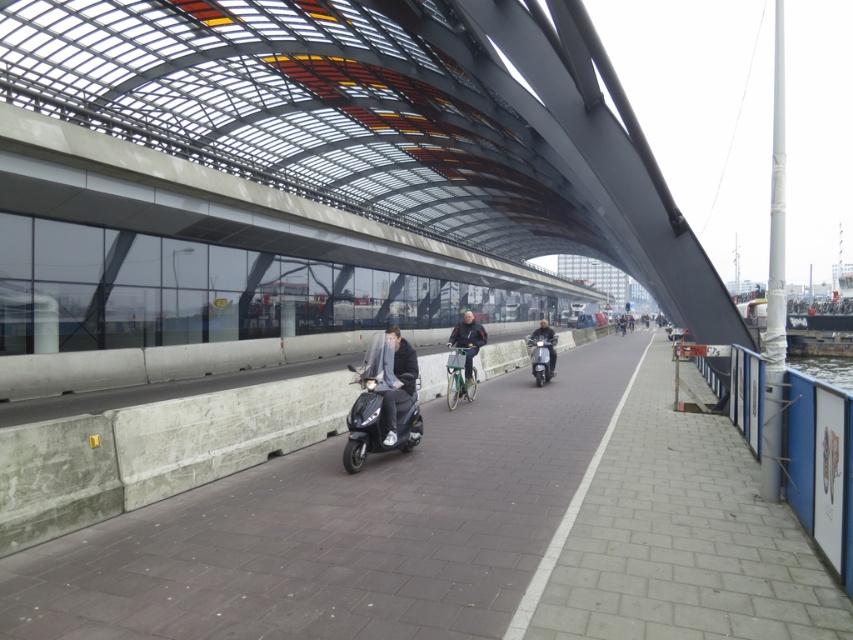
Looking at this image, measure the distance between point (363, 433) and camera.

They are 6.58 meters apart.

Based on the photo, between black matte scooter at center and shiny black scooter at center, which one is positioned lower?

black matte scooter at center

Is point (419, 435) behind point (543, 328)?

No, it is not.

Locate an element on the screen. This screenshot has width=853, height=640. black matte scooter at center is located at coordinates (376, 422).

Is metallic silver bicycle at center behind shiny black scooter at center?

No, metallic silver bicycle at center is closer to the viewer.

Between metallic silver bicycle at center and shiny black scooter at center, which one is positioned higher?

metallic silver bicycle at center is higher up.

The image size is (853, 640). What do you see at coordinates (467, 340) in the screenshot?
I see `metallic silver bicycle at center` at bounding box center [467, 340].

Where is `metallic silver bicycle at center`? The width and height of the screenshot is (853, 640). metallic silver bicycle at center is located at coordinates (467, 340).

Is matte black scooter at center to the right of metallic silver bicycle at center from the viewer's perspective?

No, matte black scooter at center is not to the right of metallic silver bicycle at center.

Does matte black scooter at center have a smaller size compared to metallic silver bicycle at center?

No.

Between point (384, 444) and point (471, 324), which one is positioned in front?

Point (384, 444) is more forward.

Where is `matte black scooter at center`? matte black scooter at center is located at coordinates (392, 376).